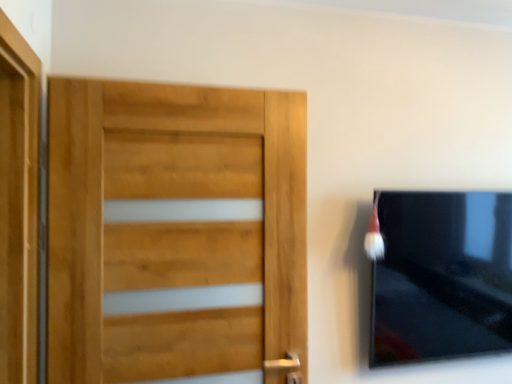
Question: In terms of width, does white fluffy brush at upper right look wider or thinner when compared to light brown wood door at left?

Choices:
 (A) thin
 (B) wide

Answer: (B)

Question: Looking at the image, does white fluffy brush at upper right seem bigger or smaller compared to light brown wood door at left?

Choices:
 (A) small
 (B) big

Answer: (A)

Question: Estimate the real-world distances between objects in this image. Which object is farther from the white fluffy brush at upper right?

Choices:
 (A) matte black tv at right
 (B) light brown wood door at left

Answer: (B)

Question: Considering the real-world distances, which object is farthest from the white fluffy brush at upper right?

Choices:
 (A) matte black tv at right
 (B) light brown wood door at left

Answer: (B)